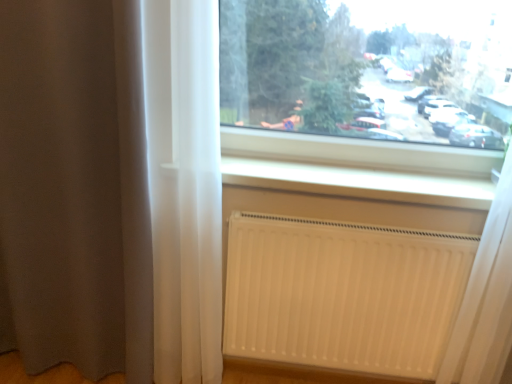
Find the location of a particular element. This screenshot has width=512, height=384. free region under transparent glass window at upper center (from a real-world perspective) is located at coordinates (326, 167).